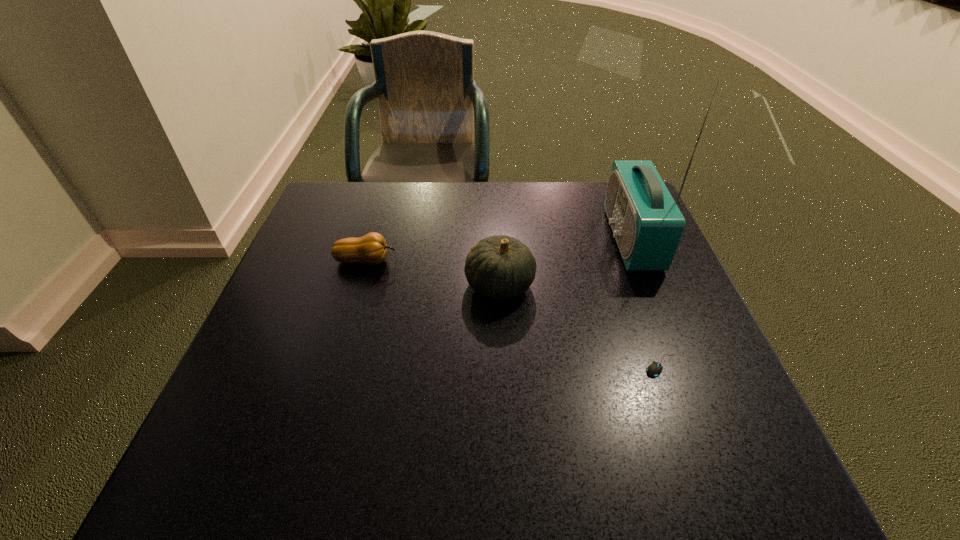
At what (x,y) coordinates should I click in order to perform the action: click on the tallest object. Please return your answer as a coordinate pair (x, y). This screenshot has height=540, width=960. Looking at the image, I should click on (647, 224).

Identify the location of the second object from left to right. (500, 267).

Locate an element on the screen. The height and width of the screenshot is (540, 960). the second tallest object is located at coordinates (500, 267).

I want to click on the leftmost object, so coord(371,248).

The height and width of the screenshot is (540, 960). In order to click on the second shortest object in this screenshot , I will do `click(371, 248)`.

Where is `mouse`? mouse is located at coordinates (653, 370).

Identify the location of the shortest object. (653, 370).

This screenshot has height=540, width=960. I want to click on vacant area located on the front panel of the tallest object, so click(507, 239).

Where is `free space located 0.080m on the front panel of the tallest object`? The width and height of the screenshot is (960, 540). free space located 0.080m on the front panel of the tallest object is located at coordinates (578, 239).

Locate an element on the screen. free region located on the front panel of the tallest object is located at coordinates (503, 239).